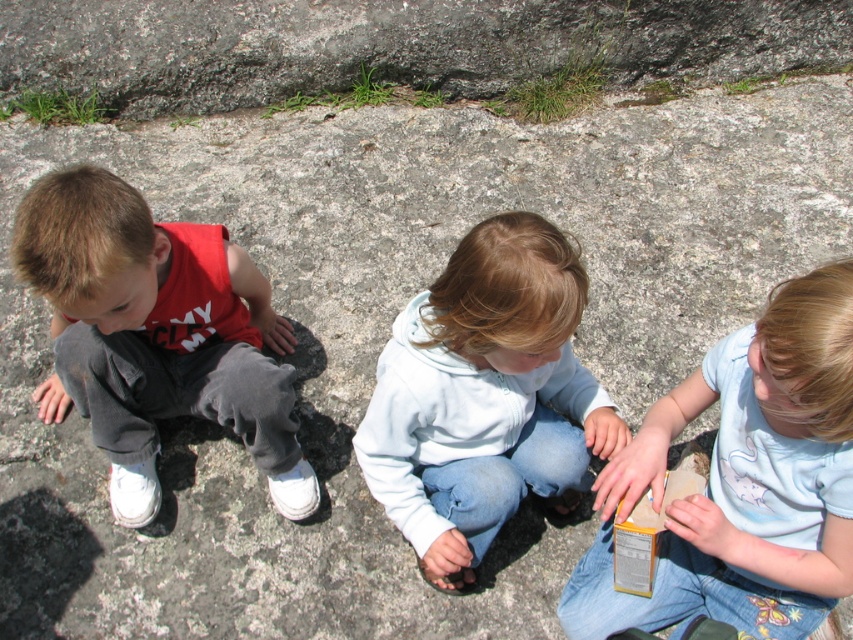
Does gray rough stone at upper center have a smaller size compared to light blue cotton shirt at center?

No.

The width and height of the screenshot is (853, 640). What do you see at coordinates (393, 44) in the screenshot?
I see `gray rough stone at upper center` at bounding box center [393, 44].

Where is `gray rough stone at upper center`? This screenshot has width=853, height=640. gray rough stone at upper center is located at coordinates [x=393, y=44].

Based on the photo, between gray rough stone at upper center and light blue fleece at center, which one appears on the left side from the viewer's perspective?

gray rough stone at upper center is more to the left.

Does gray rough stone at upper center have a greater width compared to light blue fleece at center?

Correct, the width of gray rough stone at upper center exceeds that of light blue fleece at center.

The image size is (853, 640). What do you see at coordinates (393, 44) in the screenshot?
I see `gray rough stone at upper center` at bounding box center [393, 44].

Find the location of a particular element. This screenshot has width=853, height=640. gray rough stone at upper center is located at coordinates (393, 44).

Is point (747, 579) farther from camera compared to point (161, 385)?

No.

Between light blue cotton shirt at center and matte gray pants at left, which one appears on the left side from the viewer's perspective?

matte gray pants at left is more to the left.

Is point (717, 436) positioned before point (277, 458)?

Yes, point (717, 436) is closer to viewer.

Find the location of a particular element. This screenshot has height=640, width=853. light blue cotton shirt at center is located at coordinates tap(744, 481).